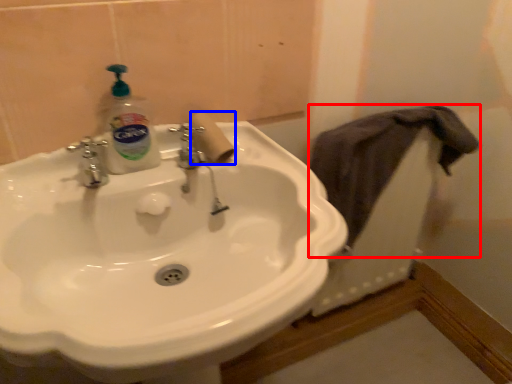
Question: Which object is closer to the camera taking this photo, bath towel (highlighted by a red box) or toilet paper (highlighted by a blue box)?

Choices:
 (A) bath towel
 (B) toilet paper

Answer: (B)